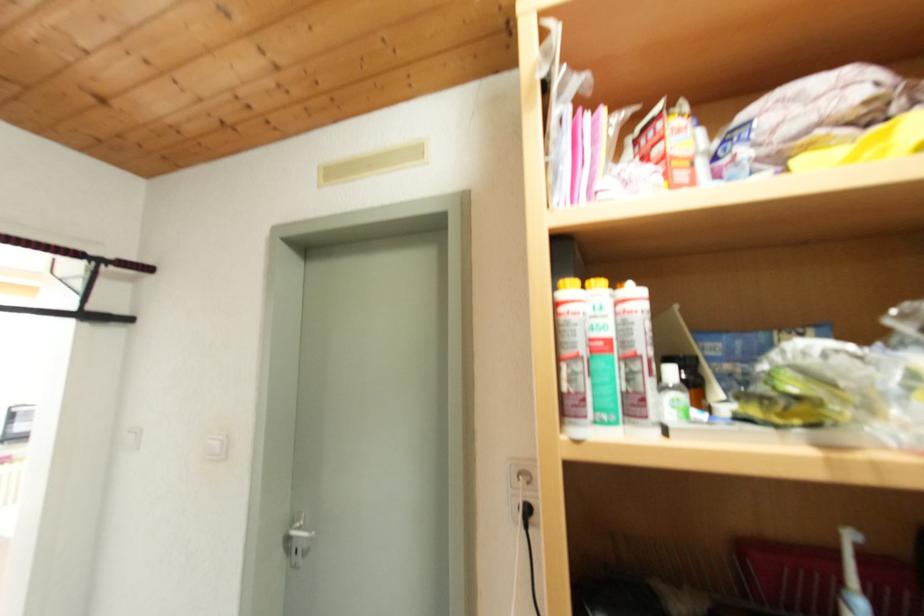
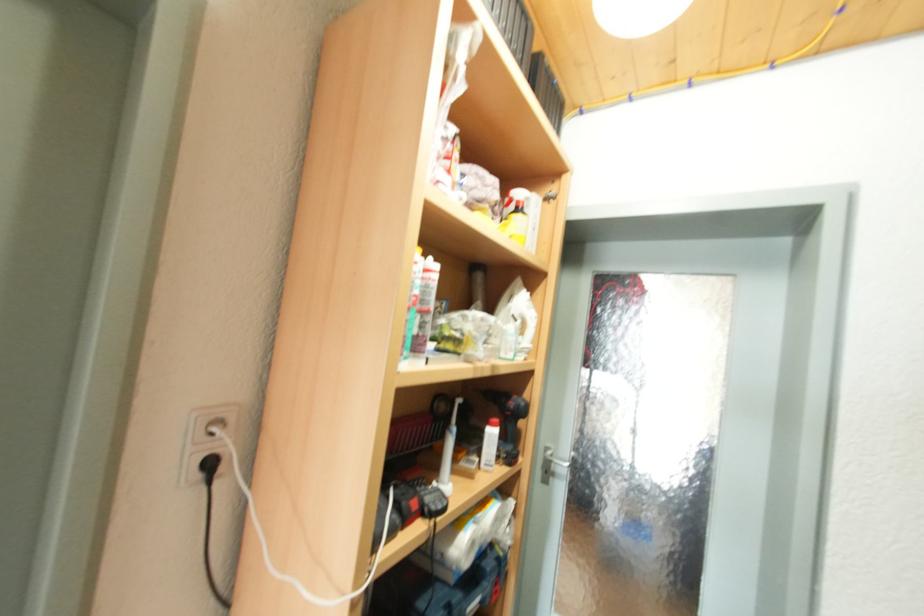
Question: Based on the continuous images, in which direction is the camera rotating? Reply with the corresponding letter.

Choices:
 (A) Left
 (B) Right
 (C) Up
 (D) Down

Answer: (B)